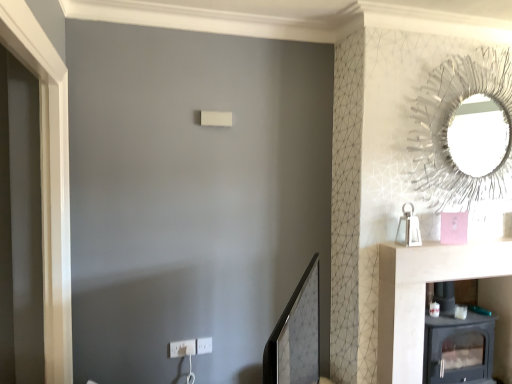
Question: Is white plastic electric outlet at lower center, acting as the 2th electric outlet starting from the left, taller than white plastic electric outlet at lower center, which is counted as the 2th electric outlet, starting from the right?

Choices:
 (A) yes
 (B) no

Answer: (B)

Question: Is white plastic electric outlet at lower center, which is the 1th electric outlet in right-to-left order, positioned far away from white plastic electric outlet at lower center, marked as the first electric outlet in a left-to-right arrangement?

Choices:
 (A) yes
 (B) no

Answer: (B)

Question: Considering the relative sizes of white plastic electric outlet at lower center, which is the 1th electric outlet in right-to-left order, and white plastic electric outlet at lower center, which is counted as the 2th electric outlet, starting from the right, in the image provided, is white plastic electric outlet at lower center, which is the 1th electric outlet in right-to-left order, smaller than white plastic electric outlet at lower center, which is counted as the 2th electric outlet, starting from the right,?

Choices:
 (A) no
 (B) yes

Answer: (B)

Question: Is white plastic electric outlet at lower center, marked as the first electric outlet in a left-to-right arrangement, a part of white plastic electric outlet at lower center, acting as the 2th electric outlet starting from the left?

Choices:
 (A) yes
 (B) no

Answer: (B)

Question: From the image's perspective, is white plastic electric outlet at lower center, acting as the 2th electric outlet starting from the left, on top of white plastic electric outlet at lower center, marked as the first electric outlet in a left-to-right arrangement?

Choices:
 (A) yes
 (B) no

Answer: (A)

Question: From the image's perspective, is white plastic electric outlet at lower center, which is the 1th electric outlet in right-to-left order, below white plastic electric outlet at lower center, marked as the first electric outlet in a left-to-right arrangement?

Choices:
 (A) yes
 (B) no

Answer: (B)

Question: Does matte black mirror at center, positioned as the 1th mirror in bottom-to-top order, have a lesser width compared to white plastic electric outlet at lower center, which is counted as the 2th electric outlet, starting from the right?

Choices:
 (A) no
 (B) yes

Answer: (A)

Question: From the image's perspective, is matte black mirror at center, the 1th mirror positioned from the left, above white plastic electric outlet at lower center, which is counted as the 2th electric outlet, starting from the right?

Choices:
 (A) yes
 (B) no

Answer: (A)

Question: Is there a large distance between matte black mirror at center, which ranks as the 2th mirror in top-to-bottom order, and white plastic electric outlet at lower center, marked as the first electric outlet in a left-to-right arrangement?

Choices:
 (A) no
 (B) yes

Answer: (A)

Question: Is matte black mirror at center, which ranks as the 2th mirror in top-to-bottom order, further to camera compared to white plastic electric outlet at lower center, which is counted as the 2th electric outlet, starting from the right?

Choices:
 (A) no
 (B) yes

Answer: (A)

Question: From a real-world perspective, is matte black mirror at center, the second mirror viewed from the right, beneath white plastic electric outlet at lower center, which is counted as the 2th electric outlet, starting from the right?

Choices:
 (A) no
 (B) yes

Answer: (A)

Question: Is matte black mirror at center, the 2th mirror viewed from the back, oriented towards white plastic electric outlet at lower center, which is counted as the 2th electric outlet, starting from the right?

Choices:
 (A) no
 (B) yes

Answer: (A)